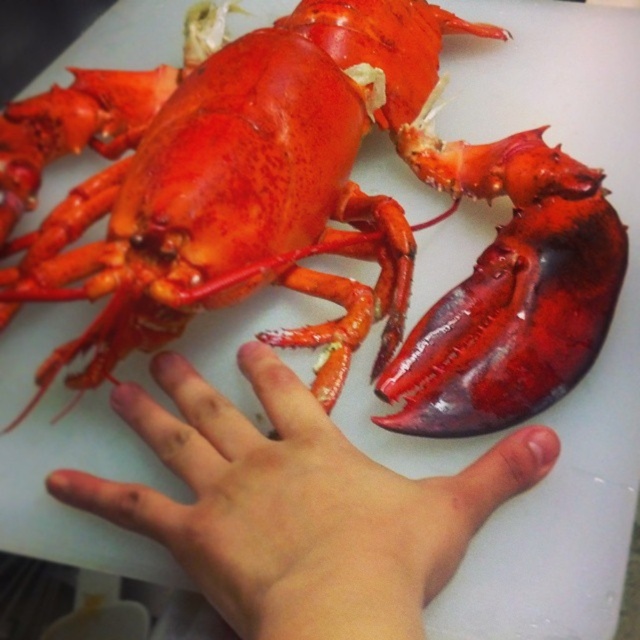
You are a chef preparing to serve a lobster dish. You have a plate that is the size of the pale skin palm at center. Will the shiny red lobster at center fit on the plate?

The shiny red lobster at center might be wider than the pale skin palm at center, so it may not fit on the plate.

You are a chef preparing a dish and see the shiny red lobster at center and the pale skin palm at center in your workspace. Which object is positioned to the right side of the other?

The shiny red lobster at center is to the right of the pale skin palm at center.